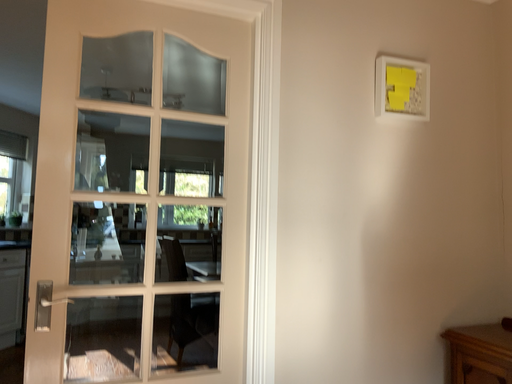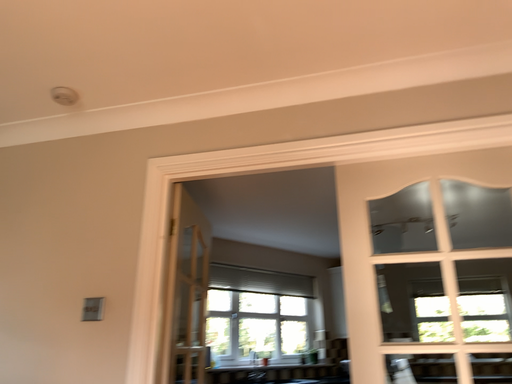
Question: Which way did the camera rotate in the video?

Choices:
 (A) rotated upward
 (B) rotated downward

Answer: (A)